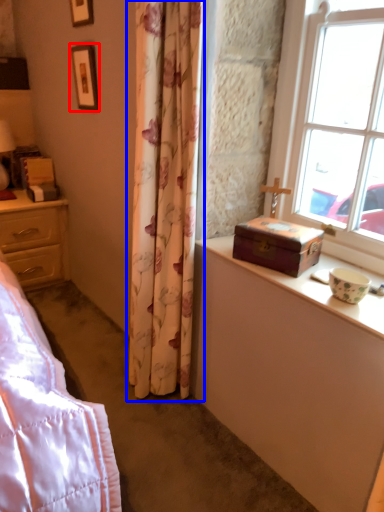
Question: Which object is closer to the camera taking this photo, picture frame (highlighted by a red box) or curtain (highlighted by a blue box)?

Choices:
 (A) picture frame
 (B) curtain

Answer: (B)